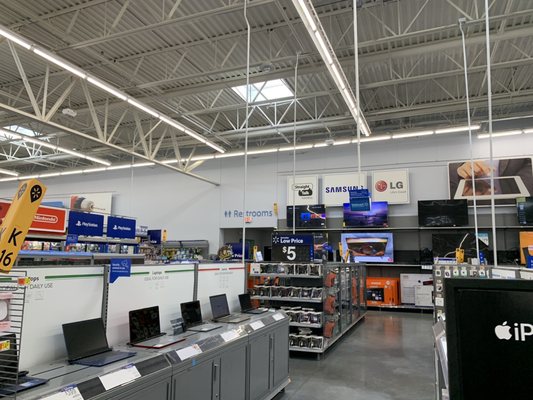
Where is `flatscreen tv`? flatscreen tv is located at coordinates (363, 216).